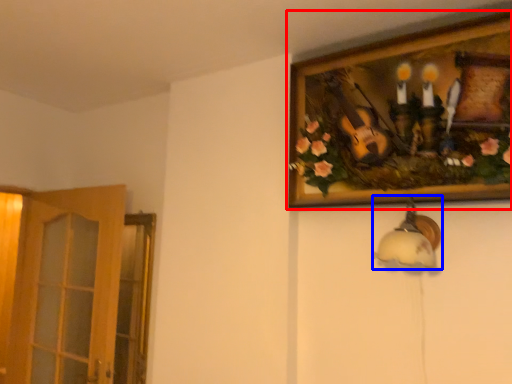
Question: Which object appears closest to the camera in this image, picture frame (highlighted by a red box) or lamp (highlighted by a blue box)?

Choices:
 (A) picture frame
 (B) lamp

Answer: (A)